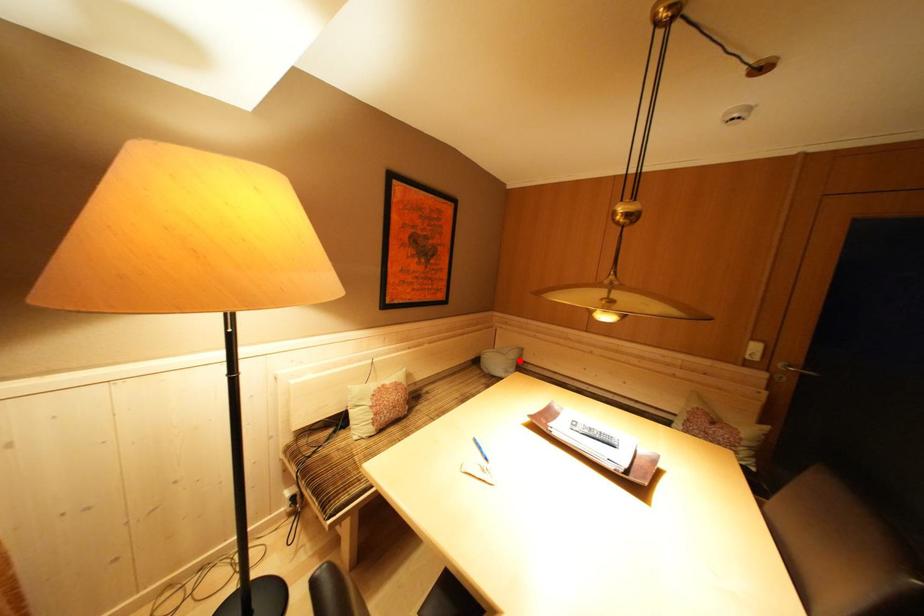
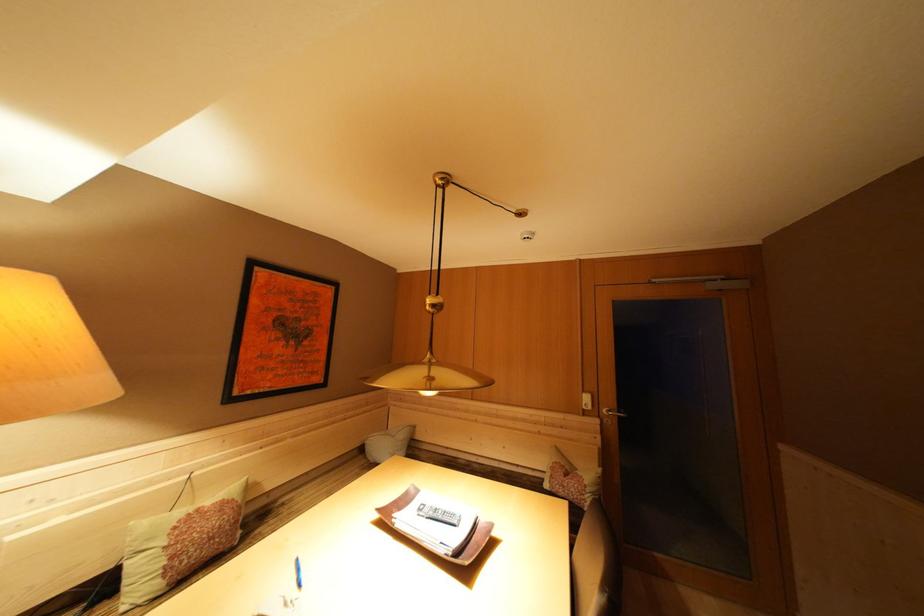
Question: I am providing you with two images of the same scene from different viewpoints. In image1, a red point is highlighted. Considering the same 3D point in image2, which of the following is correct?

Choices:
 (A) It is closer
 (B) It is farther

Answer: (B)